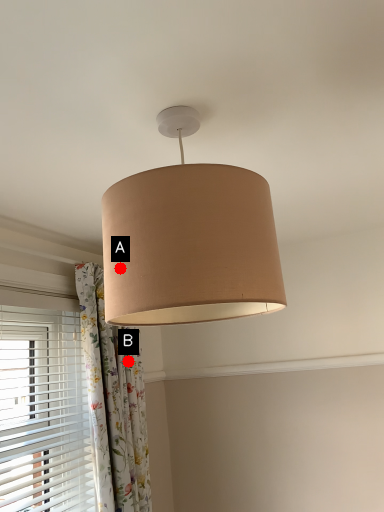
Question: Two points are circled on the image, labeled by A and B beside each circle. Which point appears farthest from the camera in this image?

Choices:
 (A) A is further
 (B) B is further

Answer: (B)